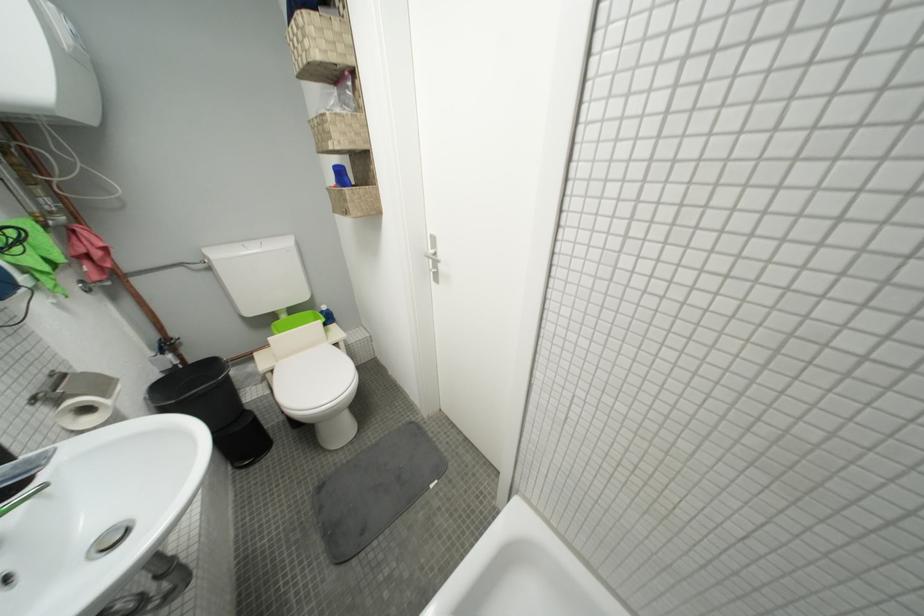
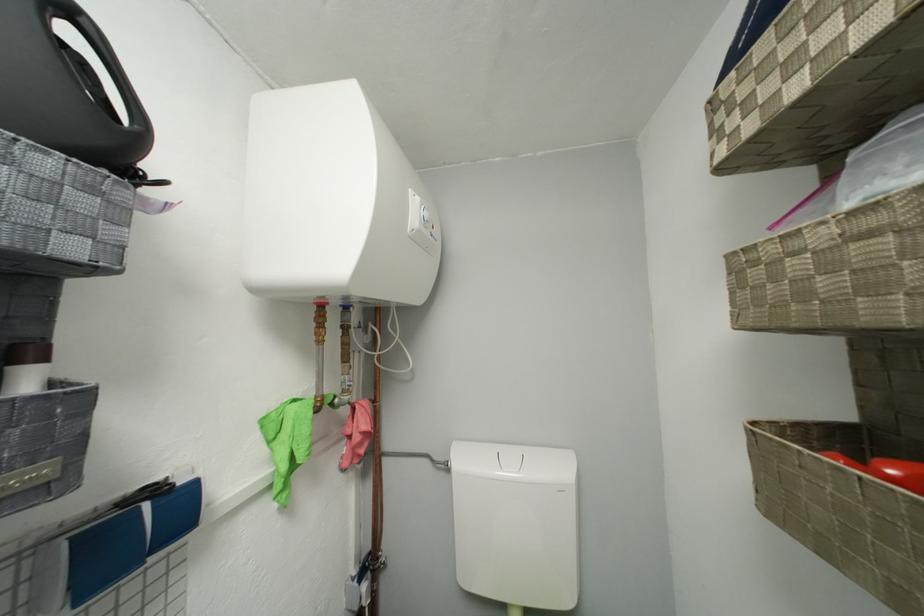
First-person continuous shooting, in which direction is the camera rotating?

The camera's rotation is toward left-up.